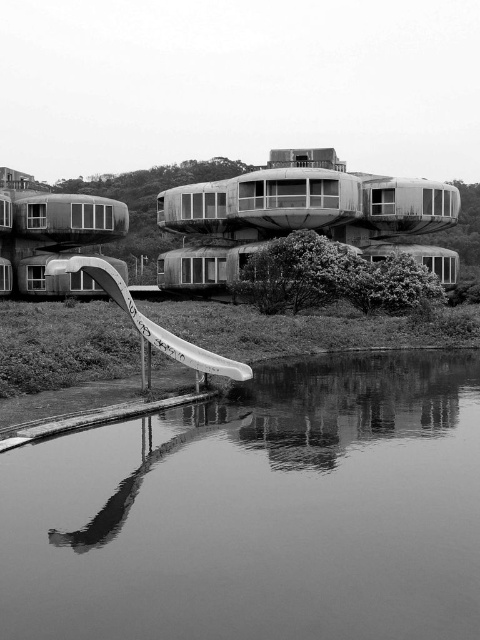
Question: Which point is closer to the camera?

Choices:
 (A) (109, 284)
 (B) (320, 420)

Answer: (B)

Question: Where is smooth water at bottom center located in relation to white plastic slide at lower left in the image?

Choices:
 (A) below
 (B) above

Answer: (A)

Question: Which point appears farthest from the camera in this image?

Choices:
 (A) (84, 259)
 (B) (49, 628)

Answer: (A)

Question: Does smooth water at bottom center appear on the right side of white plastic slide at lower left?

Choices:
 (A) no
 (B) yes

Answer: (B)

Question: Is smooth water at bottom center wider than white plastic slide at lower left?

Choices:
 (A) no
 (B) yes

Answer: (A)

Question: Among these points, which one is farthest from the camera?

Choices:
 (A) (348, 355)
 (B) (73, 257)

Answer: (B)